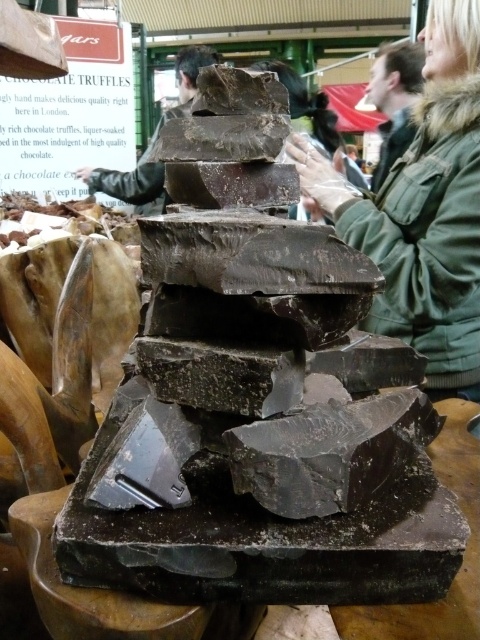
Does green wool jacket at upper right appear over dark chocolate at center?

Incorrect, green wool jacket at upper right is not positioned above dark chocolate at center.

Measure the distance between point (396, 138) and camera.

Point (396, 138) is 6.36 meters away from camera.

Identify the location of green wool jacket at upper right. [x=395, y=100].

Is green fuzzy coat at upper right above dark chocolate at center?

No, green fuzzy coat at upper right is not above dark chocolate at center.

Does green fuzzy coat at upper right appear under dark chocolate at center?

Yes, green fuzzy coat at upper right is below dark chocolate at center.

Locate an element on the screen. green fuzzy coat at upper right is located at coordinates (424, 211).

Locate an element on the screen. green fuzzy coat at upper right is located at coordinates (424, 211).

Is point (463, 92) behind point (373, 72)?

No, it is not.

Can you confirm if green fuzzy coat at upper right is taller than green wool jacket at upper right?

Yes.

Is point (368, 248) farther from camera compared to point (391, 113)?

That is False.

Identify the location of green fuzzy coat at upper right. (424, 211).